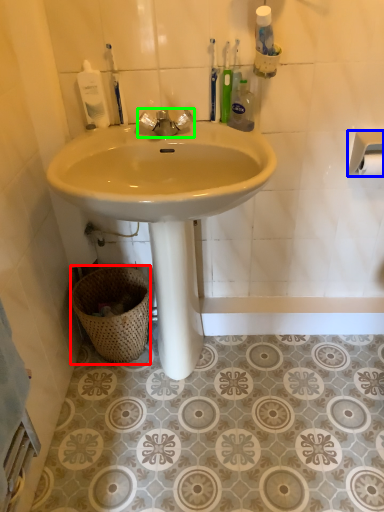
Question: Which object is the farthest from basket (highlighted by a red box)? Choose among these: towel bar (highlighted by a blue box) or tap (highlighted by a green box).

Choices:
 (A) towel bar
 (B) tap

Answer: (A)